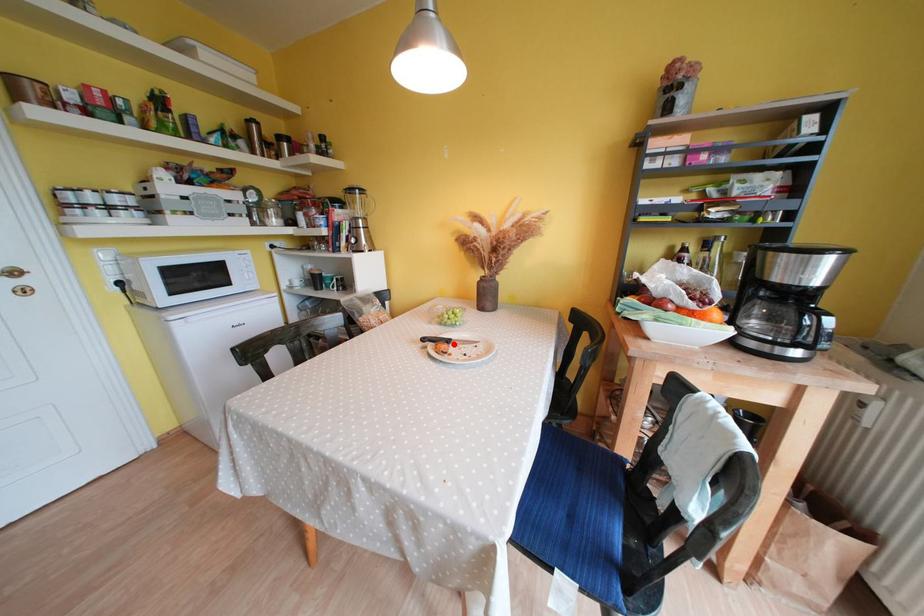
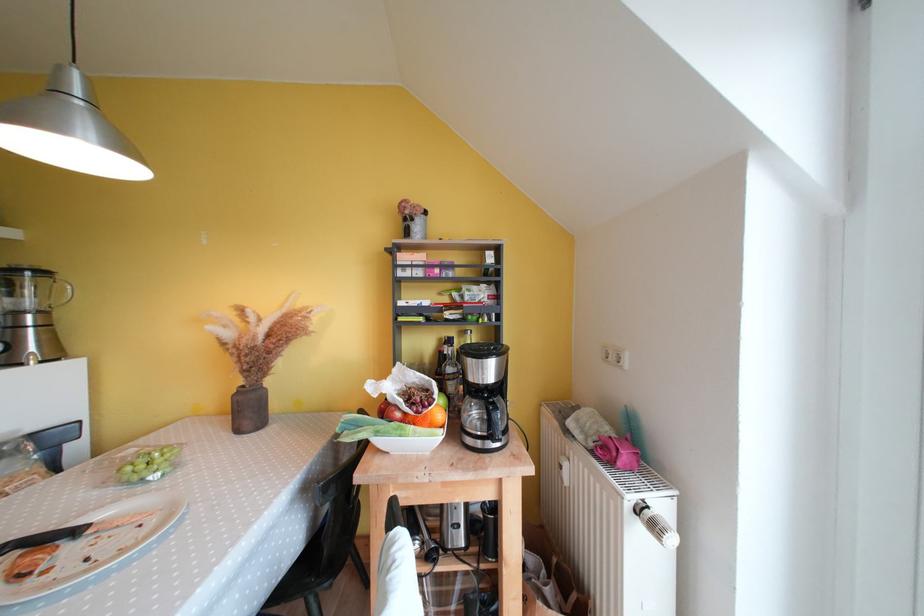
The point at the highlighted location is marked in the first image. Where is the corresponding point in the second image?

(83, 535)